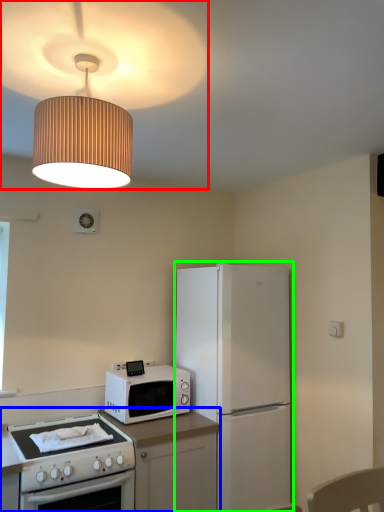
Question: Which object is positioned farthest from lamp (highlighted by a red box)? Select from countertop (highlighted by a blue box) and refrigerator (highlighted by a green box).

Choices:
 (A) countertop
 (B) refrigerator

Answer: (A)